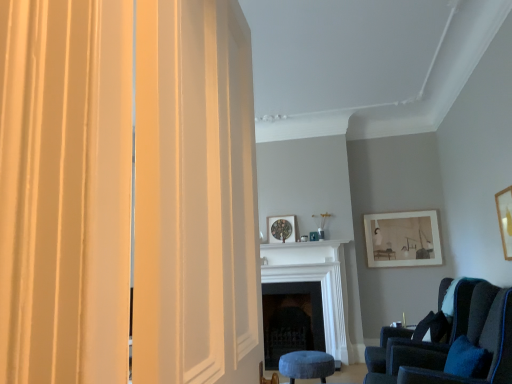
Image resolution: width=512 pixels, height=384 pixels. Describe the element at coordinates (403, 239) in the screenshot. I see `matte wooden picture frame at upper right, arranged as the second picture frame when viewed from the front` at that location.

What do you see at coordinates (455, 341) in the screenshot?
I see `velvet dark blue chair at lower right` at bounding box center [455, 341].

Locate an element on the screen. velvet blue stool at lower center is located at coordinates (306, 365).

Image resolution: width=512 pixels, height=384 pixels. What do you see at coordinates (505, 219) in the screenshot?
I see `wooden picture frame at upper right, the 3th picture frame from the left` at bounding box center [505, 219].

Where is `matte wooden picture frame at upper right, the 2th picture frame viewed from the back`? The height and width of the screenshot is (384, 512). matte wooden picture frame at upper right, the 2th picture frame viewed from the back is located at coordinates (403, 239).

From the image's perspective, is matte cream curtain at left located above matte wooden picture frame at upper right, the second picture frame in the left-to-right sequence?

Yes.

From a real-world perspective, is matte cream curtain at left beneath matte wooden picture frame at upper right, which ranks as the second picture frame in right-to-left order?

Correct, in the physical world, matte cream curtain at left is lower than matte wooden picture frame at upper right, which ranks as the second picture frame in right-to-left order.

Is matte cream curtain at left behind matte wooden picture frame at upper right, the second picture frame in the left-to-right sequence?

No.

How far apart are matte cream curtain at left and matte wooden picture frame at upper right, the second picture frame in the left-to-right sequence?

A distance of 4.86 meters exists between matte cream curtain at left and matte wooden picture frame at upper right, the second picture frame in the left-to-right sequence.

Does matte wooden picture frame at center, which is counted as the 3th picture frame, starting from the right, lie behind matte wooden picture frame at upper right, the 2th picture frame viewed from the back?

Yes, matte wooden picture frame at center, which is counted as the 3th picture frame, starting from the right, is further from the camera.

Can you confirm if matte wooden picture frame at center, acting as the first picture frame starting from the left, is positioned to the left of matte wooden picture frame at upper right, which ranks as the second picture frame in right-to-left order?

Yes.

Considering the relative sizes of matte wooden picture frame at center, which is the 3th picture frame from front to back, and matte wooden picture frame at upper right, the second picture frame in the left-to-right sequence, in the image provided, is matte wooden picture frame at center, which is the 3th picture frame from front to back, taller than matte wooden picture frame at upper right, the second picture frame in the left-to-right sequence,?

In fact, matte wooden picture frame at center, which is the 3th picture frame from front to back, may be shorter than matte wooden picture frame at upper right, the second picture frame in the left-to-right sequence.

Locate an element on the screen. Image resolution: width=512 pixels, height=384 pixels. picture frame that is the 1st one above the wooden picture frame at upper right, the 1th picture frame when ordered from right to left (from a real-world perspective) is located at coordinates point(403,239).

Considering the relative sizes of wooden picture frame at upper right, the 1th picture frame when ordered from right to left, and matte wooden picture frame at upper right, arranged as the second picture frame when viewed from the front, in the image provided, is wooden picture frame at upper right, the 1th picture frame when ordered from right to left, smaller than matte wooden picture frame at upper right, arranged as the second picture frame when viewed from the front,?

Yes.

Is wooden picture frame at upper right, the 1th picture frame when ordered from right to left, oriented towards matte wooden picture frame at upper right, the second picture frame in the left-to-right sequence?

No, wooden picture frame at upper right, the 1th picture frame when ordered from right to left, does not turn towards matte wooden picture frame at upper right, the second picture frame in the left-to-right sequence.

Can you see wooden picture frame at upper right, the 1th picture frame when ordered from right to left, touching matte wooden picture frame at upper right, which ranks as the second picture frame in right-to-left order?

No, wooden picture frame at upper right, the 1th picture frame when ordered from right to left, is not with matte wooden picture frame at upper right, which ranks as the second picture frame in right-to-left order.

Is the surface of white marble fireplace at center, which is the second fireplace in back-to-front order, in direct contact with matte wooden picture frame at upper right, which ranks as the second picture frame in right-to-left order?

No.

Measure the distance from white marble fireplace at center, which is the 1th fireplace in front-to-back order, to matte wooden picture frame at upper right, arranged as the second picture frame when viewed from the front.

The distance of white marble fireplace at center, which is the 1th fireplace in front-to-back order, from matte wooden picture frame at upper right, arranged as the second picture frame when viewed from the front, is 32.31 inches.

Relative to matte wooden picture frame at upper right, arranged as the second picture frame when viewed from the front, is white marble fireplace at center, which is the second fireplace in back-to-front order, in front or behind?

Clearly, white marble fireplace at center, which is the second fireplace in back-to-front order, is in front of matte wooden picture frame at upper right, arranged as the second picture frame when viewed from the front.

Is point (305, 244) closer to viewer compared to point (432, 220)?

No, it is not.

Is matte cream curtain at left facing towards velvet dark blue chair at lower right?

No.

In the image, is matte cream curtain at left positioned in front of or behind velvet dark blue chair at lower right?

matte cream curtain at left is positioned closer to the viewer than velvet dark blue chair at lower right.

Is matte cream curtain at left placed right next to velvet dark blue chair at lower right?

No, matte cream curtain at left is not with velvet dark blue chair at lower right.

Considering the relative sizes of matte cream curtain at left and velvet dark blue chair at lower right in the image provided, is matte cream curtain at left taller than velvet dark blue chair at lower right?

Indeed, matte cream curtain at left has a greater height compared to velvet dark blue chair at lower right.

What's the angular difference between matte cream curtain at left and matte wooden picture frame at center, acting as the first picture frame starting from the left,'s facing directions?

The angle between the facing direction of matte cream curtain at left and the facing direction of matte wooden picture frame at center, acting as the first picture frame starting from the left, is 87.7 degrees.

Is matte cream curtain at left bigger than matte wooden picture frame at center, which is counted as the 3th picture frame, starting from the right?

Indeed, matte cream curtain at left has a larger size compared to matte wooden picture frame at center, which is counted as the 3th picture frame, starting from the right.

Is matte cream curtain at left far from matte wooden picture frame at center, which is counted as the 3th picture frame, starting from the right?

That's right, there is a large distance between matte cream curtain at left and matte wooden picture frame at center, which is counted as the 3th picture frame, starting from the right.

Is matte cream curtain at left oriented away from matte wooden picture frame at center, placed as the first picture frame when sorted from back to front?

That's not correct — matte cream curtain at left is not looking away from matte wooden picture frame at center, placed as the first picture frame when sorted from back to front.

Based on the photo, is matte wooden picture frame at upper right, which ranks as the second picture frame in right-to-left order, inside the boundaries of matte wooden picture frame at center, which is the 3th picture frame from front to back, or outside?

matte wooden picture frame at upper right, which ranks as the second picture frame in right-to-left order, is not enclosed by matte wooden picture frame at center, which is the 3th picture frame from front to back.

Which of these two, matte wooden picture frame at upper right, arranged as the second picture frame when viewed from the front, or matte wooden picture frame at center, placed as the first picture frame when sorted from back to front, is smaller?

matte wooden picture frame at center, placed as the first picture frame when sorted from back to front, is smaller.

From a real-world perspective, starting from the matte wooden picture frame at center, which is the 3th picture frame from front to back, which picture frame is the 1st one below it? Please provide its 2D coordinates.

[(403, 239)]

From the image's perspective, count 3rd picture frames downward from the matte cream curtain at left and point to it. Please provide its 2D coordinates.

[(403, 239)]

From the image's perspective, which picture frame is the 1st one above the matte wooden picture frame at upper right, which ranks as the second picture frame in right-to-left order? Please provide its 2D coordinates.

[(281, 229)]

Which object lies nearer to the anchor point matte cream curtain at left, white marble fireplace at center, which is the second fireplace in back-to-front order, or matte wooden picture frame at upper right, the second picture frame in the left-to-right sequence?

Based on the image, white marble fireplace at center, which is the second fireplace in back-to-front order, appears to be nearer to matte cream curtain at left.

From the image, which object appears to be farther from white marble fireplace at center, which is the 1th fireplace in front-to-back order, matte wooden picture frame at upper right, the 2th picture frame viewed from the back, or dark wood fireplace at center, the first fireplace viewed from the back?

Based on the image, matte wooden picture frame at upper right, the 2th picture frame viewed from the back, appears to be further to white marble fireplace at center, which is the 1th fireplace in front-to-back order.

Looking at the image, which one is located closer to matte wooden picture frame at center, which is counted as the 3th picture frame, starting from the right, white marble fireplace at center, which is the 1th fireplace in front-to-back order, or wooden picture frame at upper right, which appears as the third picture frame when viewed from the back?

white marble fireplace at center, which is the 1th fireplace in front-to-back order.

Which object lies further to the anchor point velvet blue stool at lower center, wooden picture frame at upper right, which is the first picture frame from front to back, or matte wooden picture frame at upper right, arranged as the second picture frame when viewed from the front?

matte wooden picture frame at upper right, arranged as the second picture frame when viewed from the front, is positioned further to the anchor velvet blue stool at lower center.

Considering their positions, is white marble fireplace at center, which is the second fireplace in back-to-front order, positioned further to dark wood fireplace at center, marked as the second fireplace in a front-to-back arrangement, than velvet blue stool at lower center?

Based on the image, velvet blue stool at lower center appears to be further to dark wood fireplace at center, marked as the second fireplace in a front-to-back arrangement.

When comparing their distances from dark wood fireplace at center, marked as the second fireplace in a front-to-back arrangement, does matte wooden picture frame at center, acting as the first picture frame starting from the left, or white marble fireplace at center, which is the second fireplace in back-to-front order, seem closer?

The object closer to dark wood fireplace at center, marked as the second fireplace in a front-to-back arrangement, is white marble fireplace at center, which is the second fireplace in back-to-front order.

Based on their spatial positions, is white marble fireplace at center, which is the 1th fireplace in front-to-back order, or velvet dark blue chair at lower right further from matte wooden picture frame at upper right, the second picture frame in the left-to-right sequence?

velvet dark blue chair at lower right lies further to matte wooden picture frame at upper right, the second picture frame in the left-to-right sequence, than the other object.

From the picture: Based on their spatial positions, is white marble fireplace at center, which is the second fireplace in back-to-front order, or velvet dark blue chair at lower right further from matte wooden picture frame at center, which is counted as the 3th picture frame, starting from the right?

velvet dark blue chair at lower right is positioned further to the anchor matte wooden picture frame at center, which is counted as the 3th picture frame, starting from the right.

Where is `fireplace located between dark wood fireplace at center, marked as the second fireplace in a front-to-back arrangement, and matte wooden picture frame at upper right, which ranks as the second picture frame in right-to-left order, in the left-right direction`? The width and height of the screenshot is (512, 384). fireplace located between dark wood fireplace at center, marked as the second fireplace in a front-to-back arrangement, and matte wooden picture frame at upper right, which ranks as the second picture frame in right-to-left order, in the left-right direction is located at coordinates 315,280.

This screenshot has height=384, width=512. In order to click on chair between matte cream curtain at left and matte wooden picture frame at center, which is the 3th picture frame from front to back, from front to back in this screenshot , I will do `click(455, 341)`.

The image size is (512, 384). What are the coordinates of `fireplace between matte cream curtain at left and dark wood fireplace at center, the first fireplace viewed from the back, along the z-axis` in the screenshot? It's located at (315, 280).

Where is `picture frame located between velvet blue stool at lower center and matte wooden picture frame at center, which is the 3th picture frame from front to back, in the depth direction`? picture frame located between velvet blue stool at lower center and matte wooden picture frame at center, which is the 3th picture frame from front to back, in the depth direction is located at coordinates (403, 239).